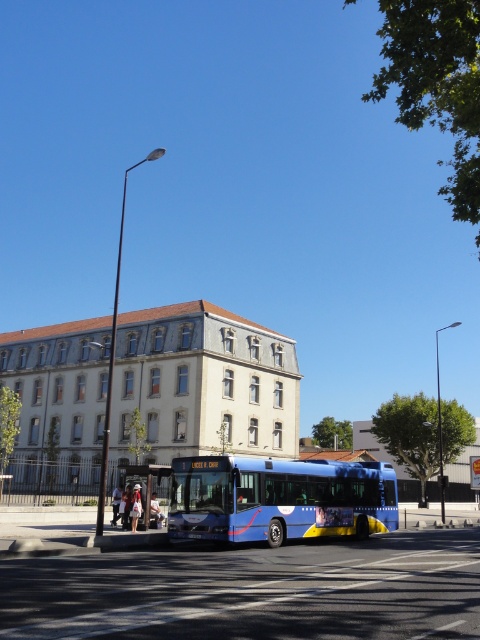
Does blue metallic bus at center appear under metallic bus stop at lower left?

Actually, blue metallic bus at center is above metallic bus stop at lower left.

Looking at this image, who is taller, blue metallic bus at center or metallic bus stop at lower left?

metallic bus stop at lower left

Does point (391, 480) come behind point (140, 472)?

That is True.

This screenshot has width=480, height=640. I want to click on blue metallic bus at center, so click(x=278, y=499).